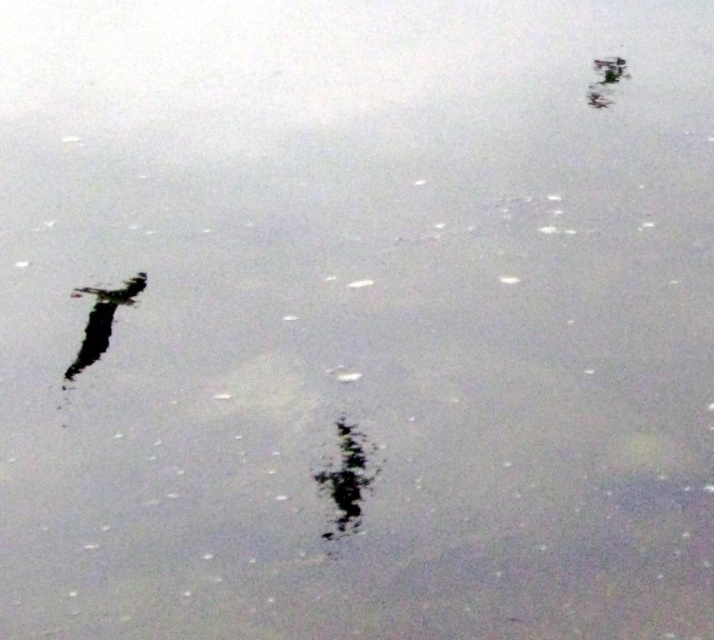
You are standing at the edge of the water and want to take a photo of the black matte tree at center. If your camera can focus up to 10 feet, will it be able to capture the tree clearly?

The black matte tree at center is 9.72 feet away from the camera, which is within the camera focus range of up to 10 feet. Therefore, the camera can capture the tree clearly.

You are a photographer trying to capture the black matte tree at center in your shot. Based on the scene description, where should you position your camera to ensure the tree is centered in the frame?

The black matte tree at center is already positioned at the center of the image according to its 2D coordinates at point (346, 477). However, since the coordinate system might vary, the photographer should adjust their camera to align the tree with the frame center using the provided coordinates.